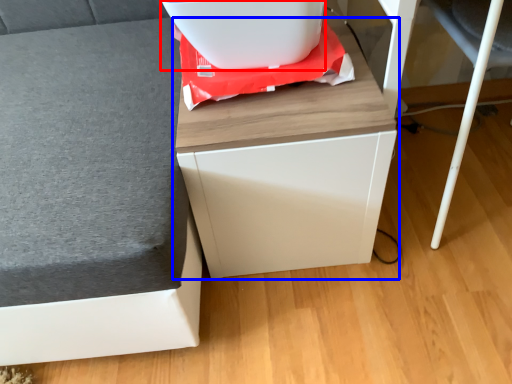
Question: Among these objects, which one is nearest to the camera, appliance (highlighted by a red box) or furniture (highlighted by a blue box)?

Choices:
 (A) appliance
 (B) furniture

Answer: (B)